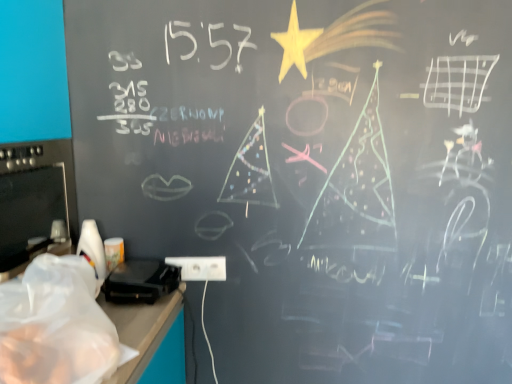
Question: Does white plastic electric outlet at lower center come behind black plastic toaster at lower left?

Choices:
 (A) yes
 (B) no

Answer: (A)

Question: Is white plastic electric outlet at lower center closer to camera compared to black plastic toaster at lower left?

Choices:
 (A) yes
 (B) no

Answer: (B)

Question: Can you confirm if white plastic electric outlet at lower center is thinner than black plastic toaster at lower left?

Choices:
 (A) yes
 (B) no

Answer: (A)

Question: From the image's perspective, is white plastic electric outlet at lower center on top of black plastic toaster at lower left?

Choices:
 (A) yes
 (B) no

Answer: (A)

Question: Is white plastic electric outlet at lower center to the right of black plastic toaster at lower left from the viewer's perspective?

Choices:
 (A) yes
 (B) no

Answer: (A)

Question: Looking at their shapes, would you say black plastic toaster at lower left is wider or thinner than transparent plastic bag at lower left?

Choices:
 (A) thin
 (B) wide

Answer: (A)

Question: Would you say black plastic toaster at lower left is inside or outside transparent plastic bag at lower left?

Choices:
 (A) inside
 (B) outside

Answer: (B)

Question: Based on their sizes in the image, would you say black plastic toaster at lower left is bigger or smaller than transparent plastic bag at lower left?

Choices:
 (A) small
 (B) big

Answer: (A)

Question: From a real-world perspective, relative to transparent plastic bag at lower left, is black plastic toaster at lower left vertically above or below?

Choices:
 (A) below
 (B) above

Answer: (A)

Question: In terms of height, does white plastic electric outlet at lower center look taller or shorter compared to transparent plastic bag at lower left?

Choices:
 (A) short
 (B) tall

Answer: (A)

Question: Is white plastic electric outlet at lower center wider or thinner than transparent plastic bag at lower left?

Choices:
 (A) thin
 (B) wide

Answer: (A)

Question: Would you say white plastic electric outlet at lower center is to the left or to the right of transparent plastic bag at lower left in the picture?

Choices:
 (A) right
 (B) left

Answer: (A)

Question: Looking at the image, does white plastic electric outlet at lower center seem bigger or smaller compared to transparent plastic bag at lower left?

Choices:
 (A) big
 (B) small

Answer: (B)

Question: In terms of height, does black plastic toaster at lower left look taller or shorter compared to white plastic electric outlet at lower center?

Choices:
 (A) short
 (B) tall

Answer: (B)

Question: In the image, is black plastic toaster at lower left positioned in front of or behind white plastic electric outlet at lower center?

Choices:
 (A) front
 (B) behind

Answer: (A)